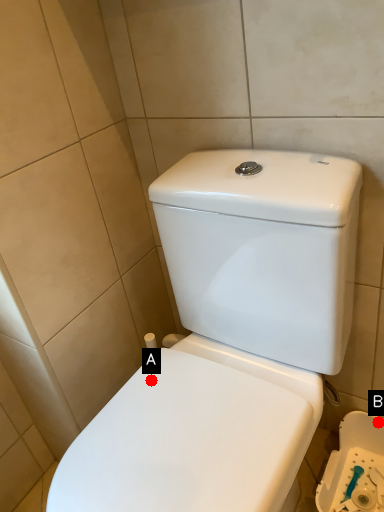
Question: Two points are circled on the image, labeled by A and B beside each circle. Which point appears closest to the camera in this image?

Choices:
 (A) A is closer
 (B) B is closer

Answer: (A)